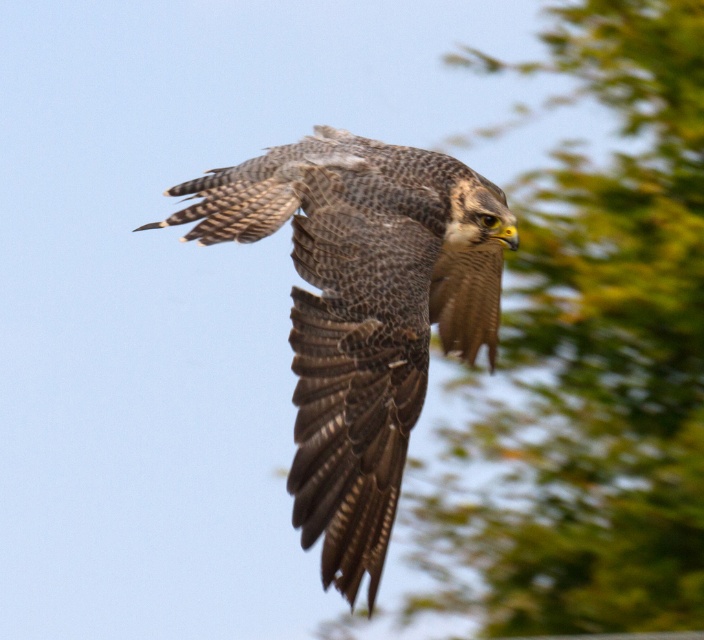
You are an ornithologist observing the speckled feathered falcon at center and the green leafy tree at upper right. Which object occupies more horizontal space in the image?

The green leafy tree at upper right occupies more horizontal space than the speckled feathered falcon at center because its width surpasses the falcon.

You are a photographer aiming to capture the speckled feathered falcon at center against the green leafy tree at upper right. Based on their positions, will the falcon appear in front of or behind the tree in the photo?

The green leafy tree at upper right is located below the speckled feathered falcon at center, so the falcon will appear in front of the tree in the photo.

You are a drone operator trying to capture the falcon in flight. You have two reference points marked as point (641, 211) and point (363, 332). Which point is closer to the falcon?

Point (363, 332) is closer to the falcon because it is in front of point (641, 211).